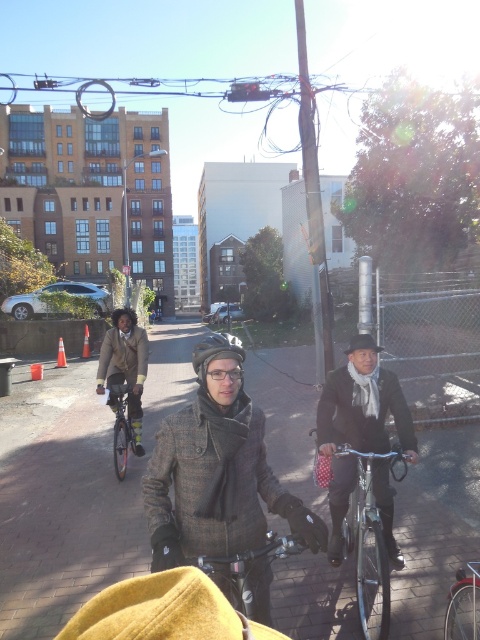
Can you confirm if black wool coat at center is positioned below leather jacket at center?

Correct, black wool coat at center is located below leather jacket at center.

Is point (330, 376) positioned before point (109, 340)?

That is True.

Who is more forward, (340, 536) or (98, 390)?

Positioned in front is point (340, 536).

The image size is (480, 640). In order to click on black wool coat at center in this screenshot , I will do `click(362, 404)`.

Can you confirm if matte gray coat at center is positioned above leather jacket at center?

Incorrect, matte gray coat at center is not positioned above leather jacket at center.

This screenshot has width=480, height=640. Describe the element at coordinates (216, 476) in the screenshot. I see `matte gray coat at center` at that location.

The image size is (480, 640). Identify the location of matte gray coat at center. (216, 476).

Is point (307, 536) closer to camera compared to point (475, 620)?

Yes, it is in front of point (475, 620).

Does matte gray coat at center have a lesser height compared to shiny silver bicycle at center?

No.

Is point (163, 436) farther from camera compared to point (468, 630)?

No.

Locate an element on the screen. matte gray coat at center is located at coordinates (216, 476).